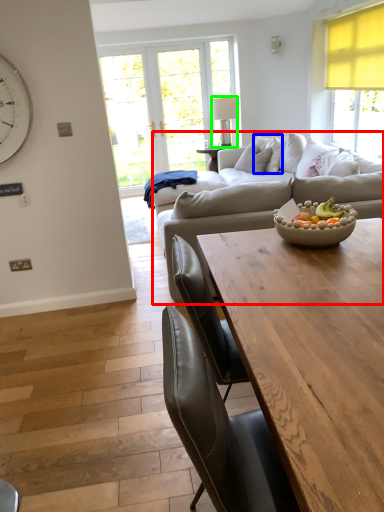
Question: Which object is positioned farthest from studio couch (highlighted by a red box)? Select from pillow (highlighted by a blue box) and lamp (highlighted by a green box).

Choices:
 (A) pillow
 (B) lamp

Answer: (B)